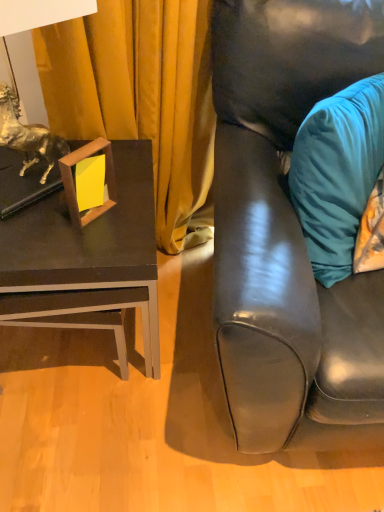
Locate an element on the screen. The height and width of the screenshot is (512, 384). free space above matte black table at left (from a real-world perspective) is located at coordinates (x=77, y=211).